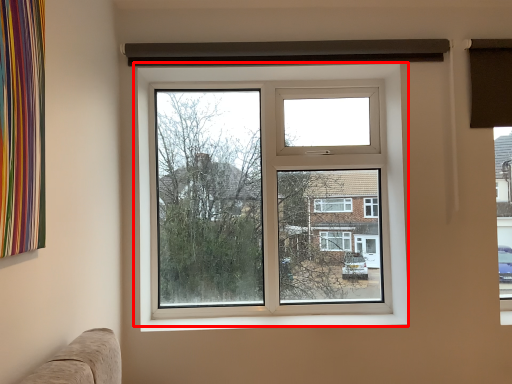
Question: Considering the relative positions of window (annotated by the red box) and window sill in the image provided, where is window (annotated by the red box) located with respect to the staircase?

Choices:
 (A) left
 (B) right

Answer: (A)